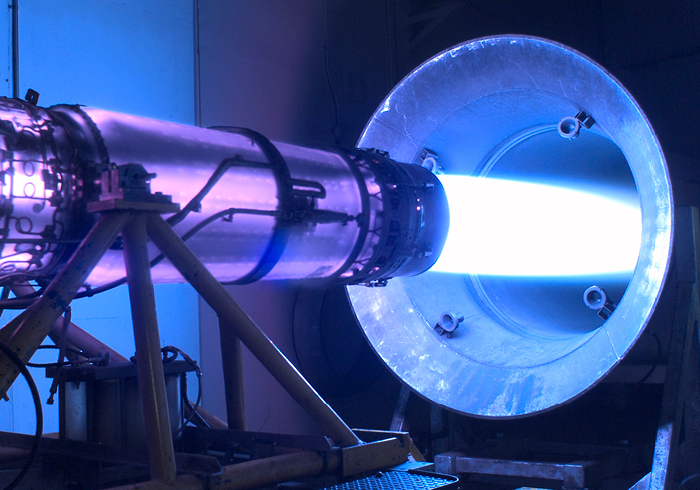
You are a GUI agent. You are given a task and a screenshot of the screen. Output one action in this format:
    pyautogui.click(x=<x>, y=<y>)
    Task: Click on the cords
    
    Given the screenshot: What is the action you would take?
    click(211, 174), click(211, 216), click(45, 363), click(56, 345), click(42, 415), click(14, 301), click(5, 285)